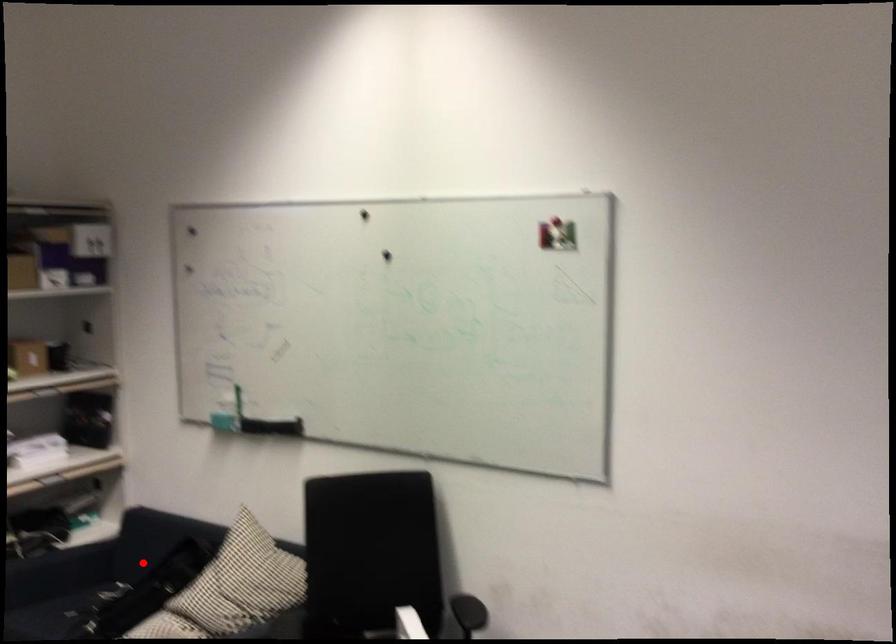
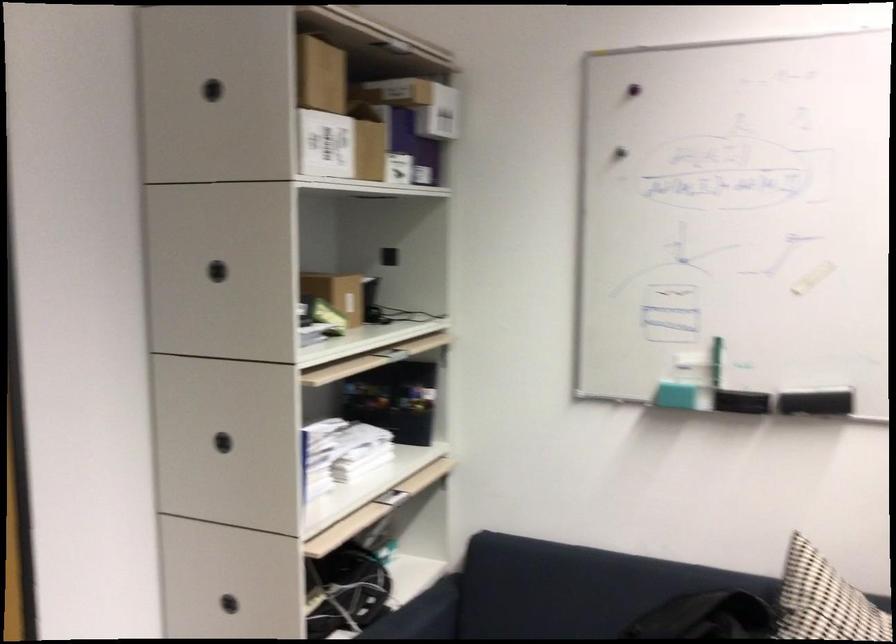
Find the pixel in the second image that matches the highlighted location in the first image.

(533, 625)